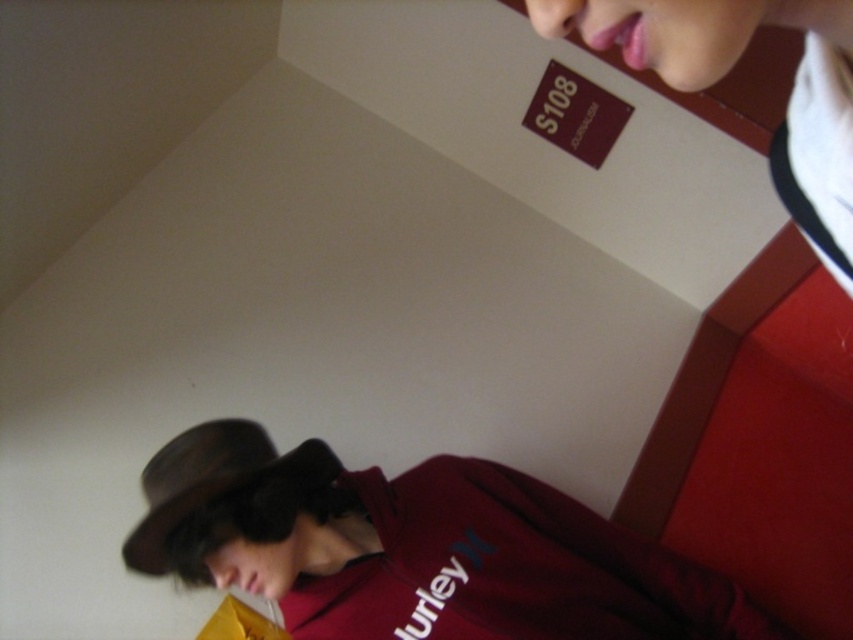
You are standing in a hotel room and see the matte maroon hoodie at lower right and the brown felt fedora at lower left. Which object is positioned lower in the image?

The matte maroon hoodie at lower right is positioned lower than the brown felt fedora at lower left.

You are standing in the hotel room and need to place a new decorative item between the matte maroon hoodie at lower right and the brown felt fedora at lower left. Based on their positions, where should you place the item so it is centered between them?

The matte maroon hoodie at lower right is to the right of the brown felt fedora at lower left, so placing the item halfway between them would mean positioning it directly in the middle horizontally between the two objects.

You are a photographer setting up a shoot in a hotel room. You have two props to place on a shelf that can only hold items narrower than the brown felt fedora at lower left. Can the matte maroon hoodie at lower right fit on the shelf?

The matte maroon hoodie at lower right is wider than the brown felt fedora at lower left, so it cannot fit on the shelf since the shelf requires items narrower than the brown felt fedora at lower left.